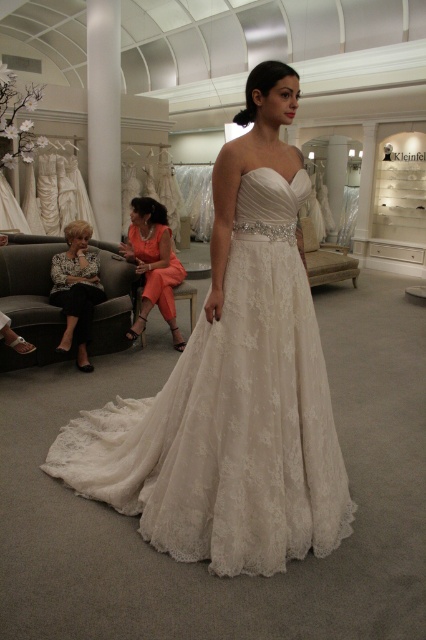
Question: Which object appears closest to the camera in this image?

Choices:
 (A) ivory lace dress at center
 (B) black leather jacket at lower left
 (C) orange satin dress at center

Answer: (A)

Question: Does ivory lace dress at center come in front of black leather jacket at lower left?

Choices:
 (A) yes
 (B) no

Answer: (A)

Question: Does ivory lace dress at center have a greater width compared to orange satin dress at center?

Choices:
 (A) yes
 (B) no

Answer: (A)

Question: Among these objects, which one is nearest to the camera?

Choices:
 (A) orange satin dress at center
 (B) ivory lace dress at center

Answer: (B)

Question: Estimate the real-world distances between objects in this image. Which object is farther from the black leather jacket at lower left?

Choices:
 (A) orange satin dress at center
 (B) ivory lace dress at center

Answer: (B)

Question: Is orange satin dress at center smaller than black leather jacket at lower left?

Choices:
 (A) yes
 (B) no

Answer: (B)